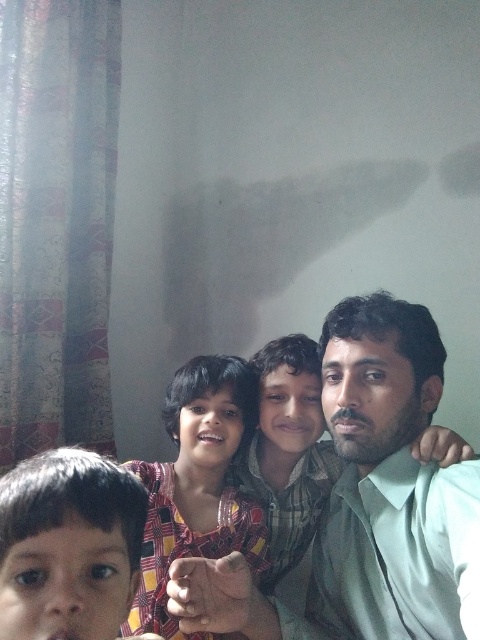
Question: Can you confirm if smooth brown hair at lower left is positioned to the right of plaid fabric shirt at center?

Choices:
 (A) yes
 (B) no

Answer: (B)

Question: Which of the following is the closest to the observer?

Choices:
 (A) (381, 540)
 (B) (134, 604)
 (C) (352, 442)

Answer: (A)

Question: Which object appears closest to the camera in this image?

Choices:
 (A) plaid fabric shirt at center
 (B) matte green shirt at center
 (C) light green shirt at center

Answer: (B)

Question: Is smooth brown hair at lower left above light green shirt at center?

Choices:
 (A) yes
 (B) no

Answer: (A)

Question: Which of the following is the farthest from the observer?

Choices:
 (A) plaid fabric shirt at center
 (B) light green shirt at center
 (C) matte green shirt at center
 (D) smooth brown hair at lower left

Answer: (A)

Question: Is smooth brown hair at lower left wider than light green shirt at center?

Choices:
 (A) no
 (B) yes

Answer: (A)